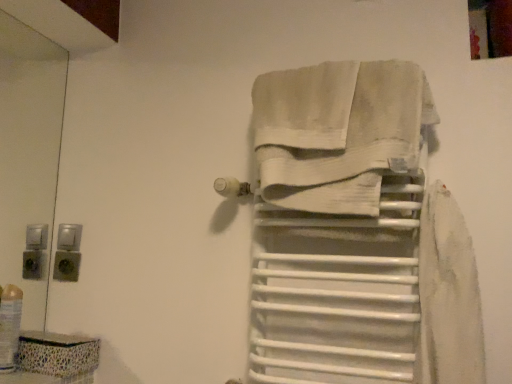
Locate an element on the screen. white cotton towel at center is located at coordinates (338, 132).

This screenshot has width=512, height=384. What do you see at coordinates (337, 291) in the screenshot? I see `white matte towel rack at center` at bounding box center [337, 291].

In the scene shown: Measure the distance between white matte towel rack at center and camera.

white matte towel rack at center and camera are 35.67 inches apart.

The width and height of the screenshot is (512, 384). What are the coordinates of `translucent plastic bottle at lower left` in the screenshot? It's located at (9, 326).

Where is `white cotton towel at center`? This screenshot has width=512, height=384. white cotton towel at center is located at coordinates (338, 132).

Looking at this image, is white cotton towel at center positioned with its back to translucent plastic bottle at lower left?

No.

Considering the positions of objects white cotton towel at center and translucent plastic bottle at lower left in the image provided, who is more to the right, white cotton towel at center or translucent plastic bottle at lower left?

white cotton towel at center.

Can you tell me how much white cotton towel at center and translucent plastic bottle at lower left differ in facing direction?

The facing directions of white cotton towel at center and translucent plastic bottle at lower left are 89.7 degrees apart.

Who is smaller, white cotton towel at center or translucent plastic bottle at lower left?

With smaller size is translucent plastic bottle at lower left.

Is white matte towel rack at center directly adjacent to white cotton towel at center?

No, white matte towel rack at center is not touching white cotton towel at center.

Based on the photo, is white matte towel rack at center at the right side of white cotton towel at center?

In fact, white matte towel rack at center is to the left of white cotton towel at center.

Is white matte towel rack at center oriented away from white cotton towel at center?

No, white cotton towel at center is not at the back of white matte towel rack at center.

Is translucent plastic bottle at lower left oriented away from white cotton towel at center?

No, white cotton towel at center is not at the back of translucent plastic bottle at lower left.

What's the angular difference between translucent plastic bottle at lower left and white cotton towel at center's facing directions?

The facing directions of translucent plastic bottle at lower left and white cotton towel at center are 89.7 degrees apart.

Would you say translucent plastic bottle at lower left is a long distance from white cotton towel at center?

No, translucent plastic bottle at lower left is in close proximity to white cotton towel at center.

Does translucent plastic bottle at lower left have a larger size compared to white cotton towel at center?

Actually, translucent plastic bottle at lower left might be smaller than white cotton towel at center.

Would you say white cotton towel at center is to the left or to the right of white matte towel rack at center in the picture?

Based on their positions, white cotton towel at center is located to the right of white matte towel rack at center.

Which object is closer to the camera taking this photo, white cotton towel at center or white matte towel rack at center?

white cotton towel at center is more forward.

Considering the relative sizes of white cotton towel at center and white matte towel rack at center in the image provided, is white cotton towel at center taller than white matte towel rack at center?

No.

At what (x,y) coordinates should I click in order to perform the action: click on shelf on the right of translucent plastic bottle at lower left. Please return your answer as a coordinate pair (x, y). Image resolution: width=512 pixels, height=384 pixels. Looking at the image, I should click on pyautogui.click(x=337, y=291).

Based on the photo, is translucent plastic bottle at lower left thinner than white matte towel rack at center?

Yes, translucent plastic bottle at lower left is thinner than white matte towel rack at center.

Between translucent plastic bottle at lower left and white matte towel rack at center, which one is positioned behind?

translucent plastic bottle at lower left is further from the camera.

Are translucent plastic bottle at lower left and white matte towel rack at center far apart?

No.

Consider the image. From a real-world perspective, which is physically below, white matte towel rack at center or translucent plastic bottle at lower left?

translucent plastic bottle at lower left is physically lower.

Which is behind, point (340, 362) or point (5, 344)?

The point (5, 344) is more distant.

Which object is closer to the camera taking this photo, white matte towel rack at center or translucent plastic bottle at lower left?

Positioned in front is white matte towel rack at center.

How distant is white matte towel rack at center from translucent plastic bottle at lower left?

white matte towel rack at center and translucent plastic bottle at lower left are 32.80 inches apart.

You are a GUI agent. You are given a task and a screenshot of the screen. Output one action in this format:
    pyautogui.click(x=<x>, y=<y>)
    Task: Click on the towel lying on the right of translucent plastic bottle at lower left
    The image size is (512, 384).
    Given the screenshot: What is the action you would take?
    pyautogui.click(x=338, y=132)

At what (x,y) coordinates should I click in order to perform the action: click on shelf behind the white cotton towel at center. Please return your answer as a coordinate pair (x, y). The width and height of the screenshot is (512, 384). Looking at the image, I should click on click(337, 291).

Based on their spatial positions, is translucent plastic bottle at lower left or white cotton towel at center closer to white matte towel rack at center?

white cotton towel at center lies closer to white matte towel rack at center than the other object.

Which object lies nearer to the anchor point white cotton towel at center, white matte towel rack at center or translucent plastic bottle at lower left?

white matte towel rack at center lies closer to white cotton towel at center than the other object.

Looking at the image, which one is located further to white cotton towel at center, translucent plastic bottle at lower left or white matte towel rack at center?

translucent plastic bottle at lower left is positioned further to the anchor white cotton towel at center.

When comparing their distances from translucent plastic bottle at lower left, does white matte towel rack at center or white cotton towel at center seem closer?

white matte towel rack at center lies closer to translucent plastic bottle at lower left than the other object.

Which object lies further to the anchor point white matte towel rack at center, white cotton towel at center or translucent plastic bottle at lower left?

translucent plastic bottle at lower left.

Which object lies nearer to the anchor point translucent plastic bottle at lower left, white cotton towel at center or white matte towel rack at center?

white matte towel rack at center.

Locate an element on the screen. This screenshot has width=512, height=384. shelf between translucent plastic bottle at lower left and white cotton towel at center from left to right is located at coordinates (337, 291).